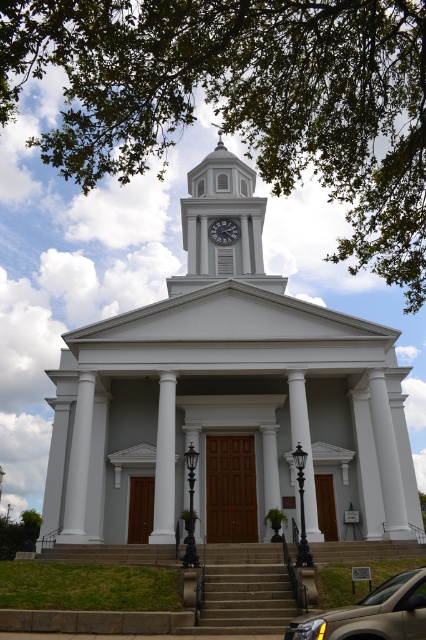
Question: Which point is farther to the camera?

Choices:
 (A) (181, 218)
 (B) (166, 486)

Answer: (A)

Question: Does green leafy tree at upper center have a greater width compared to matte gold suv at lower center?

Choices:
 (A) yes
 (B) no

Answer: (A)

Question: Is the position of white smooth church at center more distant than that of brown stone stairs at center?

Choices:
 (A) yes
 (B) no

Answer: (A)

Question: Is brown stone stairs at center wider than white clock face at center?

Choices:
 (A) yes
 (B) no

Answer: (B)

Question: Which point is closer to the camera?

Choices:
 (A) (293, 627)
 (B) (111, 364)
 (C) (221, 243)

Answer: (A)

Question: Which of these objects is positioned closest to the matte gold suv at lower center?

Choices:
 (A) white glossy clock tower at center
 (B) brown stone stairs at center
 (C) white smooth column at center

Answer: (B)